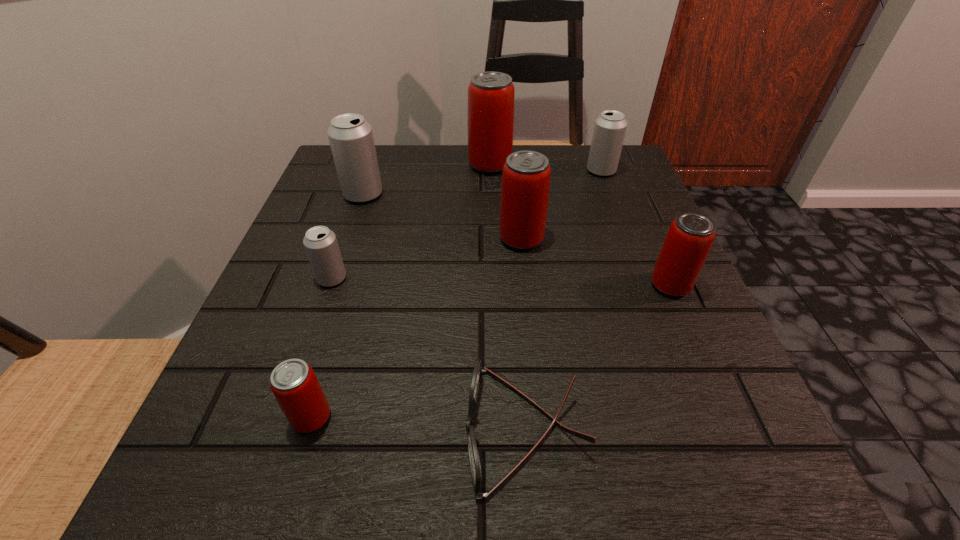
Where is `the farthest pink beer can`? This screenshot has height=540, width=960. the farthest pink beer can is located at coordinates (491, 95).

Locate an element on the screen. Image resolution: width=960 pixels, height=540 pixels. the tallest object is located at coordinates (491, 95).

At what (x,y) coordinates should I click in order to perform the action: click on the fourth farthest beer can. Please return your answer as a coordinate pair (x, y). The width and height of the screenshot is (960, 540). Looking at the image, I should click on 526,175.

The height and width of the screenshot is (540, 960). I want to click on the fifth nearest object, so click(x=526, y=175).

Where is `the sixth nearest object`? the sixth nearest object is located at coordinates (351, 139).

Locate an element on the screen. The height and width of the screenshot is (540, 960). the second farthest white beer can is located at coordinates (351, 139).

Locate an element on the screen. The width and height of the screenshot is (960, 540). the second biggest white beer can is located at coordinates (609, 131).

Locate an element on the screen. The height and width of the screenshot is (540, 960). the farthest white beer can is located at coordinates (609, 131).

Image resolution: width=960 pixels, height=540 pixels. I want to click on the second nearest pink beer can, so click(x=690, y=236).

Image resolution: width=960 pixels, height=540 pixels. I want to click on the third biggest pink beer can, so click(690, 236).